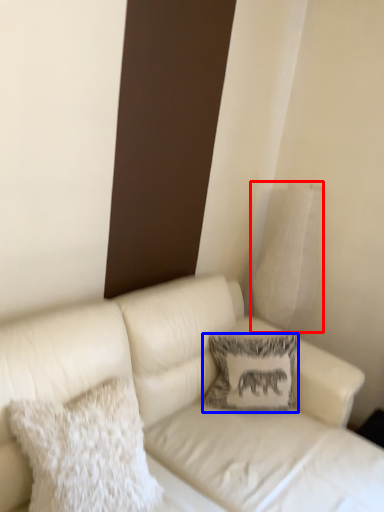
Question: Which object is further to the camera taking this photo, pillow (highlighted by a red box) or pillow (highlighted by a blue box)?

Choices:
 (A) pillow
 (B) pillow

Answer: (A)